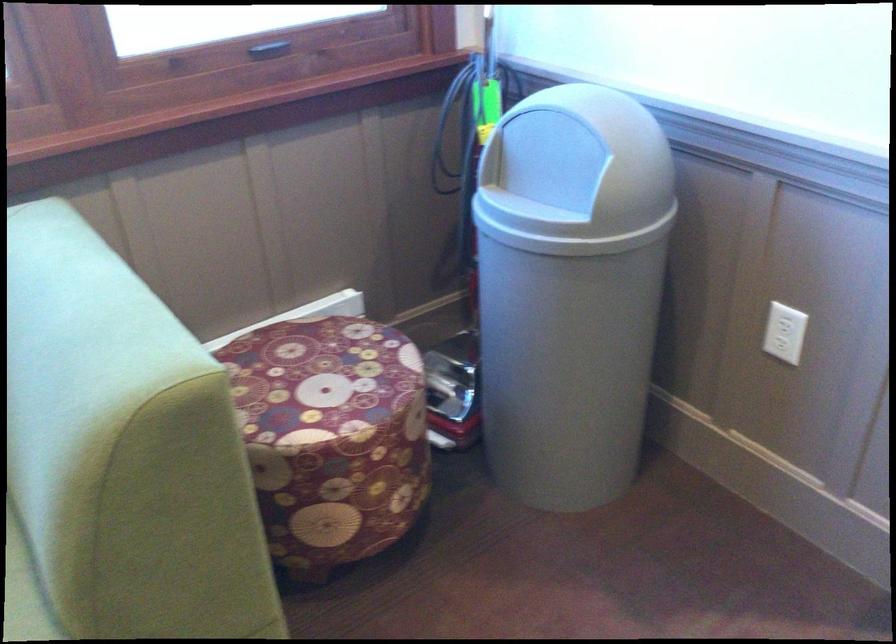
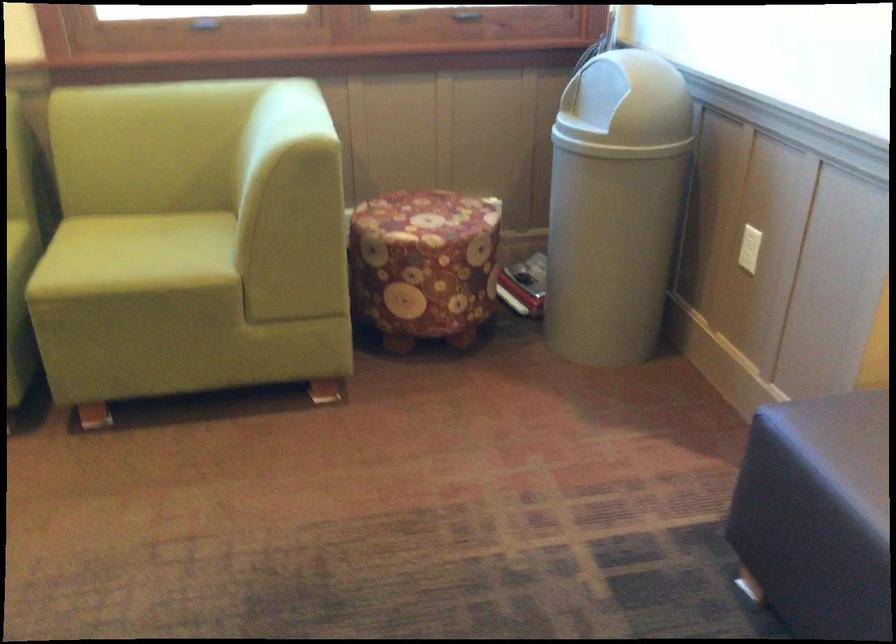
In the second image, find the point that corresponds to [547,169] in the first image.

(598, 99)